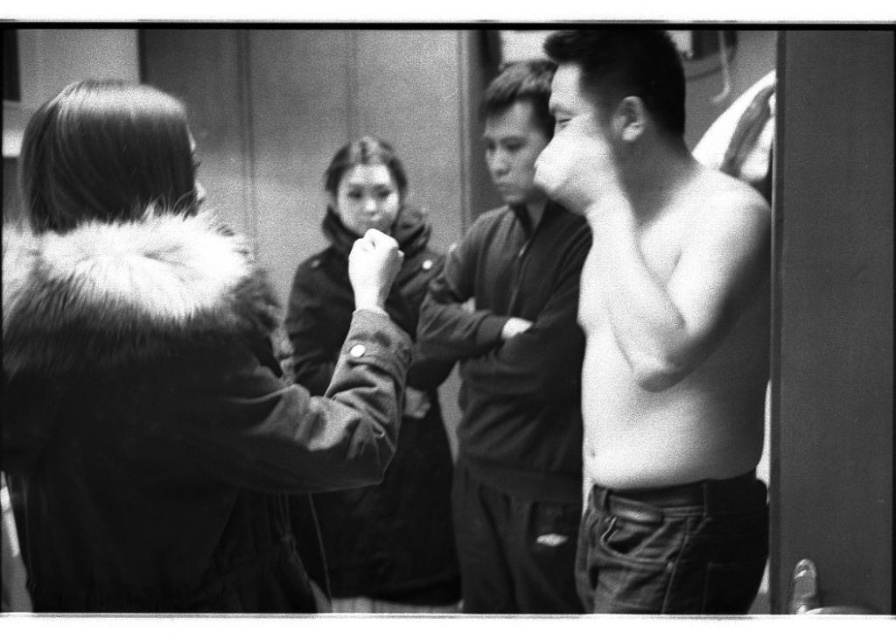
In the middle of the scene, there are two people. One has a smooth skin torso at center and the other is wearing a smooth black shirt at center. Which one is shorter?

The smooth skin torso at center is shorter than the smooth black shirt at center.